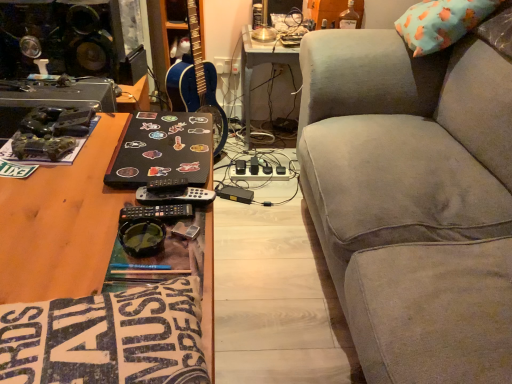
Question: Is white plastic table at center taller than blue glossy guitar at center?

Choices:
 (A) yes
 (B) no

Answer: (B)

Question: Is white plastic table at center wider than blue glossy guitar at center?

Choices:
 (A) no
 (B) yes

Answer: (B)

Question: From a real-world perspective, is white plastic table at center over blue glossy guitar at center?

Choices:
 (A) yes
 (B) no

Answer: (B)

Question: Can blue glossy guitar at center be found inside white plastic table at center?

Choices:
 (A) no
 (B) yes

Answer: (A)

Question: Does white plastic table at center turn towards blue glossy guitar at center?

Choices:
 (A) yes
 (B) no

Answer: (B)

Question: Can you confirm if white plastic table at center is bigger than blue glossy guitar at center?

Choices:
 (A) no
 (B) yes

Answer: (B)

Question: From the image's perspective, is blue glossy guitar at center above sticker-covered black laptop at center?

Choices:
 (A) yes
 (B) no

Answer: (A)

Question: Does blue glossy guitar at center have a smaller size compared to sticker-covered black laptop at center?

Choices:
 (A) no
 (B) yes

Answer: (A)

Question: Is blue glossy guitar at center outside sticker-covered black laptop at center?

Choices:
 (A) no
 (B) yes

Answer: (B)

Question: Is blue glossy guitar at center not near sticker-covered black laptop at center?

Choices:
 (A) yes
 (B) no

Answer: (B)

Question: Could you tell me if blue glossy guitar at center is turned towards sticker-covered black laptop at center?

Choices:
 (A) no
 (B) yes

Answer: (B)

Question: Does blue glossy guitar at center have a greater height compared to sticker-covered black laptop at center?

Choices:
 (A) no
 (B) yes

Answer: (B)

Question: Considering the relative sizes of gray fabric couch at right and black plastic remote at center in the image provided, is gray fabric couch at right bigger than black plastic remote at center?

Choices:
 (A) no
 (B) yes

Answer: (B)